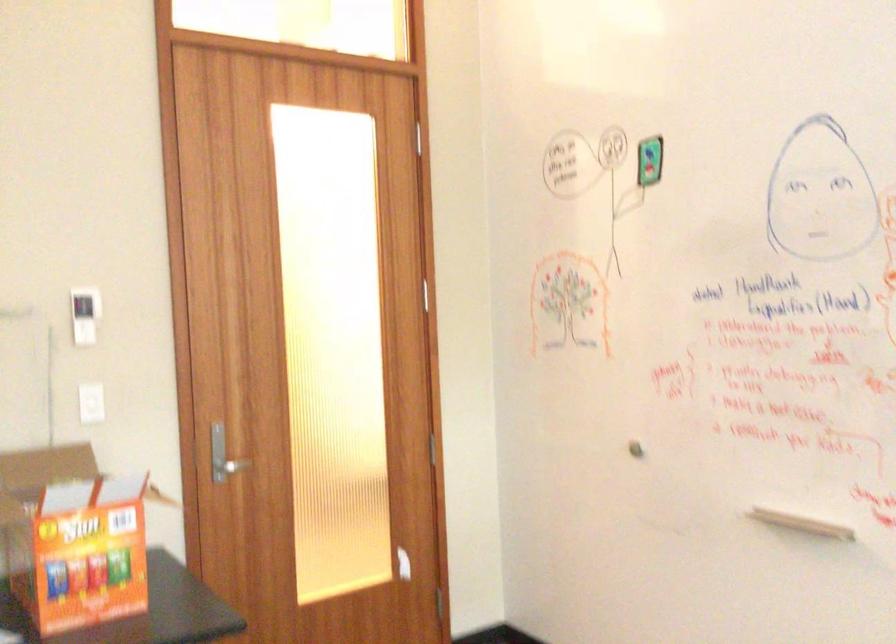
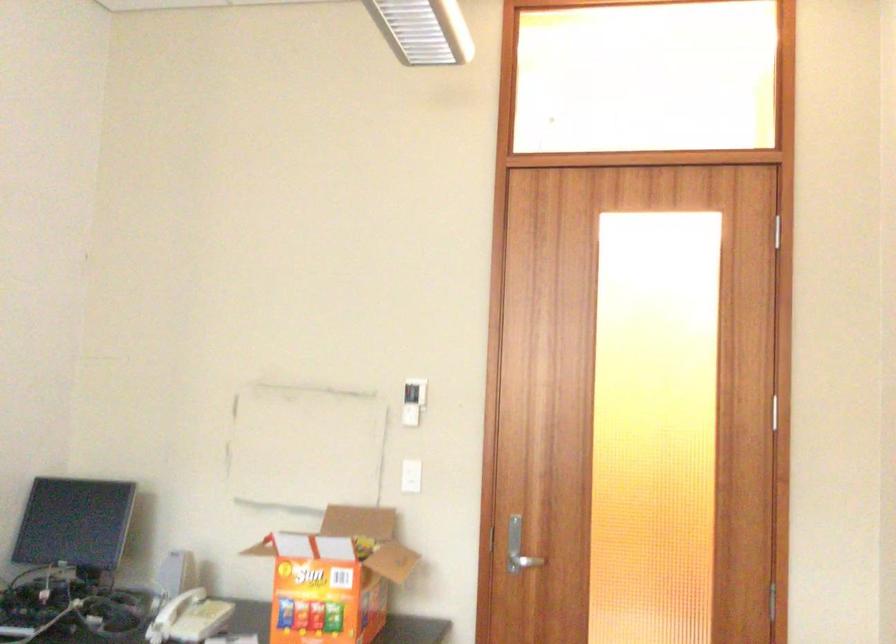
Find the pixel in the second image that matches point 113,520 in the first image.

(334, 576)